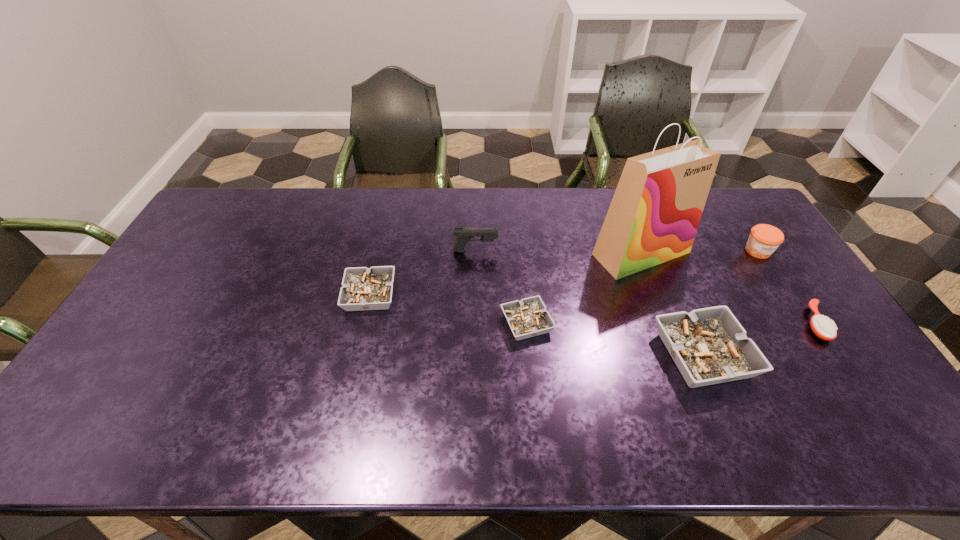
Identify the location of hairbrush that is at the right edge. This screenshot has height=540, width=960. [824, 328].

Where is `vacant space at the far edge of the desktop`? The height and width of the screenshot is (540, 960). vacant space at the far edge of the desktop is located at coordinates (283, 222).

This screenshot has height=540, width=960. Find the location of `vacant space at the near edge of the desktop`. vacant space at the near edge of the desktop is located at coordinates click(x=761, y=388).

At what (x,y) coordinates should I click in order to perform the action: click on free space at the left edge of the desktop. Please return your answer as a coordinate pair (x, y). The width and height of the screenshot is (960, 540). Looking at the image, I should click on (199, 258).

In the image, there is a desktop. Identify the location of vacant space at the right edge. Image resolution: width=960 pixels, height=540 pixels. (743, 231).

Where is `vacant position at the far right corner of the desktop`? The height and width of the screenshot is (540, 960). vacant position at the far right corner of the desktop is located at coordinates coord(739,201).

Locate an element on the screen. This screenshot has width=960, height=540. free point between the jam and the leftmost object is located at coordinates (564, 273).

Locate an element on the screen. vacant region between the leftmost object and the tallest object is located at coordinates (506, 274).

Where is `blank region between the shortest ashtray and the rightmost ashtray`? blank region between the shortest ashtray and the rightmost ashtray is located at coordinates (615, 339).

Where is `vacant area that lies between the fifth object from right to left and the second tallest object`? vacant area that lies between the fifth object from right to left and the second tallest object is located at coordinates (501, 287).